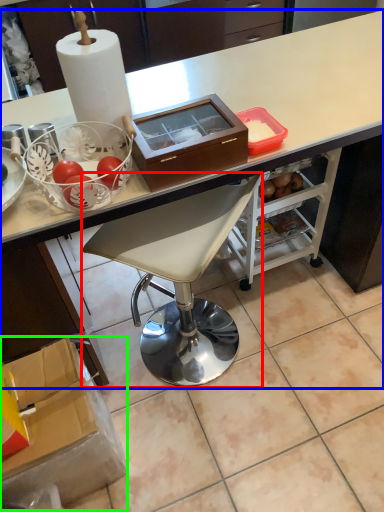
Question: Considering the real-world distances, which object is farthest from chair (highlighted by a red box)? desk (highlighted by a blue box) or box (highlighted by a green box)?

Choices:
 (A) desk
 (B) box

Answer: (A)